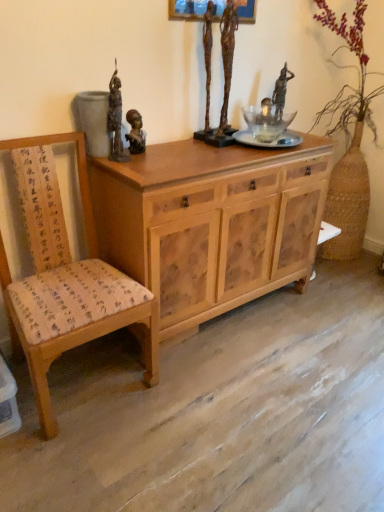
What are the coordinates of `vacant space in front of bronze statue at center, the first person in the left-to-right sequence` in the screenshot? It's located at (148, 159).